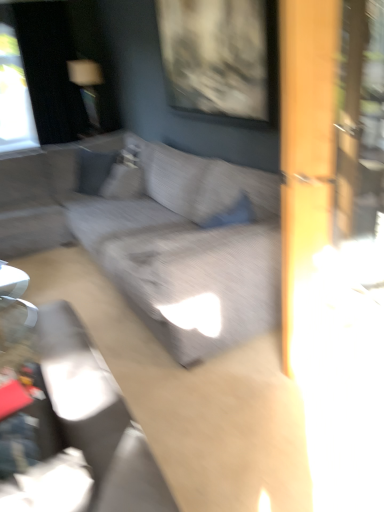
Image resolution: width=384 pixels, height=512 pixels. What do you see at coordinates (123, 182) in the screenshot?
I see `suede-like gray pillow at upper left` at bounding box center [123, 182].

Identify the location of suede-like gray pillow at upper left. (123, 182).

Based on the photo, considering the sizes of objects textured gray couch at center and suede-like gray pillow at upper left in the image provided, who is thinner, textured gray couch at center or suede-like gray pillow at upper left?

With smaller width is suede-like gray pillow at upper left.

From the image's perspective, is textured gray couch at center on suede-like gray pillow at upper left?

Incorrect, from the image's perspective, textured gray couch at center is lower than suede-like gray pillow at upper left.

From a real-world perspective, relative to suede-like gray pillow at upper left, is textured gray couch at center vertically above or below?

textured gray couch at center is situated lower than suede-like gray pillow at upper left in the real world.

Does textured gray couch at center touch matte gray swivel chair at center?

textured gray couch at center and matte gray swivel chair at center are not in contact.

From the image's perspective, which object appears higher, textured gray couch at center or matte gray swivel chair at center?

textured gray couch at center, from the image's perspective.

Considering the sizes of objects textured gray couch at center and matte gray swivel chair at center in the image provided, who is bigger, textured gray couch at center or matte gray swivel chair at center?

textured gray couch at center.

This screenshot has width=384, height=512. Find the location of `swivel chair below the textured gray couch at center (from the image's perspective)`. swivel chair below the textured gray couch at center (from the image's perspective) is located at coordinates (97, 416).

How distant is matte gray swivel chair at center from textured gray couch at center?

They are 1.13 meters apart.

Which of these two, matte gray swivel chair at center or textured gray couch at center, is smaller?

matte gray swivel chair at center is smaller.

From a real-world perspective, is matte gray swivel chair at center physically above textured gray couch at center?

Result: Actually, matte gray swivel chair at center is physically below textured gray couch at center in the real world.

In terms of height, does matte gray swivel chair at center look taller or shorter compared to textured gray couch at center?

Clearly, matte gray swivel chair at center is taller compared to textured gray couch at center.

Does suede-like gray pillow at upper left contain matte gray swivel chair at center?

No, matte gray swivel chair at center is not inside suede-like gray pillow at upper left.

From the image's perspective, relative to matte gray swivel chair at center, is suede-like gray pillow at upper left above or below?

From the image's perspective, suede-like gray pillow at upper left appears above matte gray swivel chair at center.

Considering the sizes of objects suede-like gray pillow at upper left and matte gray swivel chair at center in the image provided, who is shorter, suede-like gray pillow at upper left or matte gray swivel chair at center?

Standing shorter between the two is suede-like gray pillow at upper left.

Does point (110, 178) appear closer or farther from the camera than point (15, 165)?

Point (110, 178).

In the scene shown: Is suede-like gray pillow at upper left wider than textured gray couch at center?

No.

Is suede-like gray pillow at upper left oriented away from textured gray couch at center?

No.

Is matte gray swivel chair at center positioned with its back to suede-like gray pillow at upper left?

matte gray swivel chair at center does not have its back to suede-like gray pillow at upper left.

Choose the correct answer: Is matte gray swivel chair at center inside suede-like gray pillow at upper left or outside it?

matte gray swivel chair at center is not enclosed by suede-like gray pillow at upper left.

Is matte gray swivel chair at center taller or shorter than suede-like gray pillow at upper left?

Clearly, matte gray swivel chair at center is taller compared to suede-like gray pillow at upper left.

Does matte gray swivel chair at center appear on the right side of suede-like gray pillow at upper left?

Yes.

Where is `pillow that is above the textured gray couch at center (from the image's perspective)`? The height and width of the screenshot is (512, 384). pillow that is above the textured gray couch at center (from the image's perspective) is located at coordinates (123, 182).

Identify the location of swivel chair below the textured gray couch at center (from a real-world perspective). (97, 416).

Based on their spatial positions, is matte gray swivel chair at center or textured gray couch at center closer to suede-like gray pillow at upper left?

Among the two, textured gray couch at center is located nearer to suede-like gray pillow at upper left.

From the image, which object appears to be farther from textured gray couch at center, matte gray swivel chair at center or suede-like gray pillow at upper left?

matte gray swivel chair at center.

Based on their spatial positions, is suede-like gray pillow at upper left or textured gray couch at center further from matte gray swivel chair at center?

suede-like gray pillow at upper left is further to matte gray swivel chair at center.

Looking at the image, which one is located further to textured gray couch at center, suede-like gray pillow at upper left or matte gray swivel chair at center?

The object further to textured gray couch at center is matte gray swivel chair at center.

Which object lies nearer to the anchor point matte gray swivel chair at center, textured gray couch at center or suede-like gray pillow at upper left?

textured gray couch at center is closer to matte gray swivel chair at center.

Estimate the real-world distances between objects in this image. Which object is further from suede-like gray pillow at upper left, textured gray couch at center or matte gray swivel chair at center?

Based on the image, matte gray swivel chair at center appears to be further to suede-like gray pillow at upper left.

Locate an element on the screen. The height and width of the screenshot is (512, 384). studio couch between matte gray swivel chair at center and suede-like gray pillow at upper left in the front-back direction is located at coordinates (158, 238).